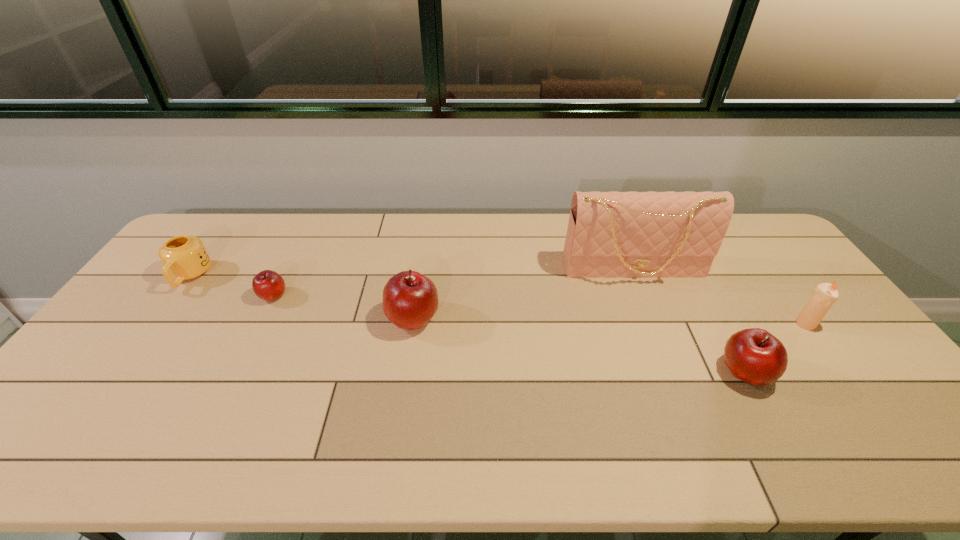
Find the location of a particular element. The height and width of the screenshot is (540, 960). free location at the right edge of the desktop is located at coordinates (788, 262).

You are a GUI agent. You are given a task and a screenshot of the screen. Output one action in this format:
    pyautogui.click(x=<x>, y=<y>)
    Task: Click on the free space at the near left corner
    
    Given the screenshot: What is the action you would take?
    pyautogui.click(x=83, y=397)

The height and width of the screenshot is (540, 960). What are the coordinates of `empty space that is in between the second shortest object and the second apple from right to left` in the screenshot? It's located at (301, 297).

This screenshot has width=960, height=540. In order to click on empty location between the shortest object and the nearest object in this screenshot , I will do (509, 334).

The width and height of the screenshot is (960, 540). In order to click on vacant region between the third object from left to right and the leftmost object in this screenshot , I will do `click(301, 297)`.

Where is `vacant space in between the second apple from right to left and the shortest apple`? The image size is (960, 540). vacant space in between the second apple from right to left and the shortest apple is located at coordinates (344, 307).

Image resolution: width=960 pixels, height=540 pixels. Find the location of `free point between the mug and the rightmost apple`. free point between the mug and the rightmost apple is located at coordinates (468, 324).

Where is `blank region between the nearest object and the handbag`? blank region between the nearest object and the handbag is located at coordinates (689, 321).

Locate an element on the screen. The image size is (960, 540). free space between the fifth tallest object and the candle is located at coordinates (497, 300).

Find the location of a particular element. This screenshot has width=960, height=540. free space between the leftmost object and the candle is located at coordinates (497, 300).